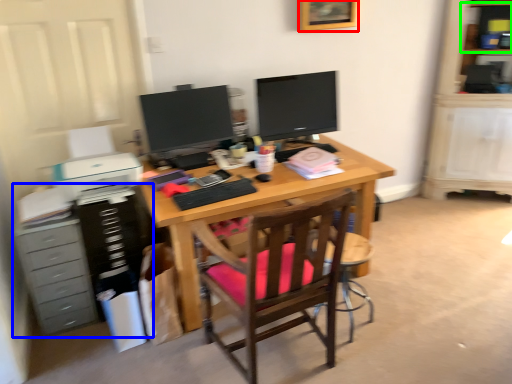
Question: Which is farther away from picture frame (highlighted by a red box)? dresser (highlighted by a blue box) or shelf (highlighted by a green box)?

Choices:
 (A) dresser
 (B) shelf

Answer: (A)